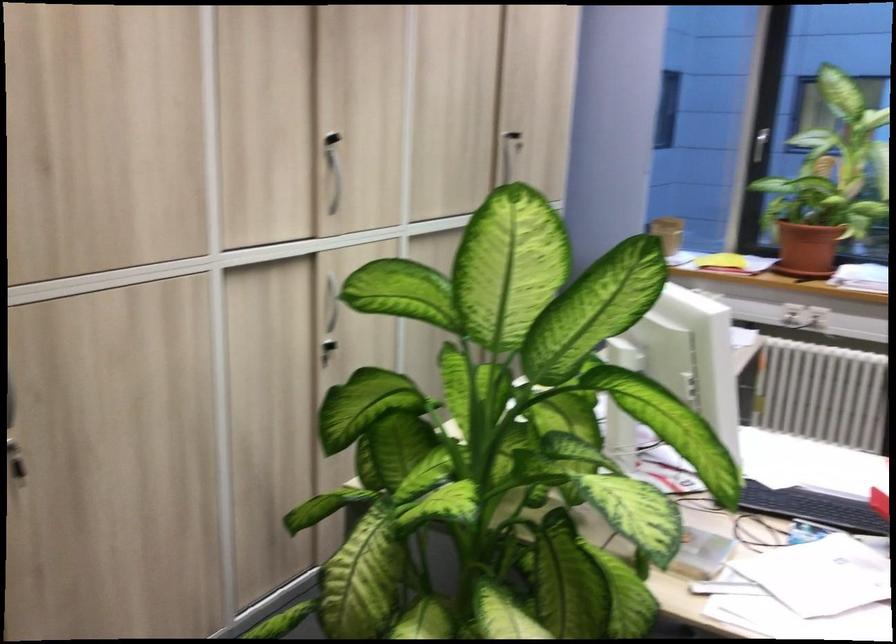
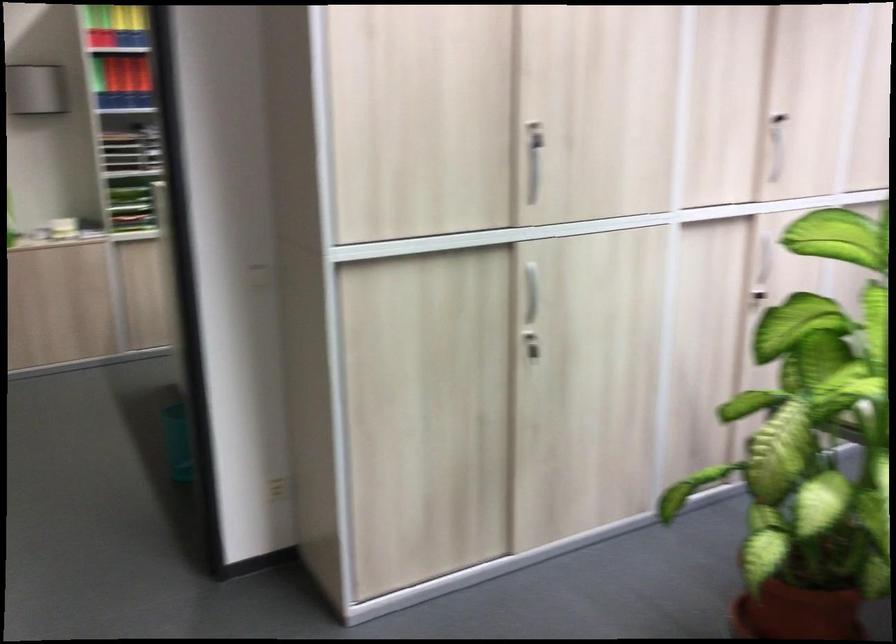
The point at (342, 190) is marked in the first image. Where is the corresponding point in the second image?

(779, 166)